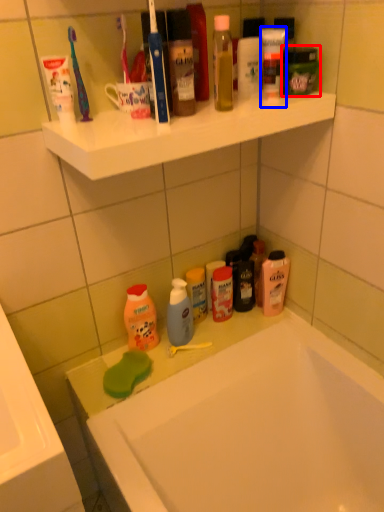
Question: Which object is closer to the camera taking this photo, mouthwash (highlighted by a red box) or toiletry (highlighted by a blue box)?

Choices:
 (A) mouthwash
 (B) toiletry

Answer: (B)